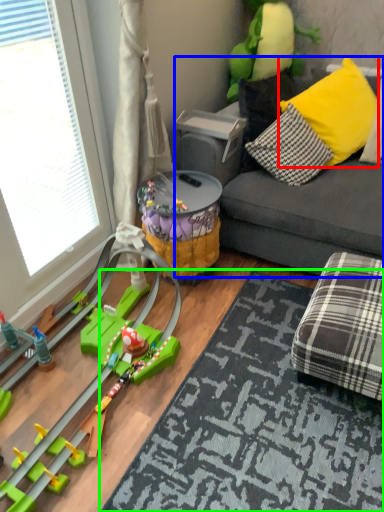
Question: Which object is positioned closest to pillow (highlighted by a red box)? Select from studio couch (highlighted by a blue box) and mat (highlighted by a green box).

Choices:
 (A) studio couch
 (B) mat

Answer: (A)